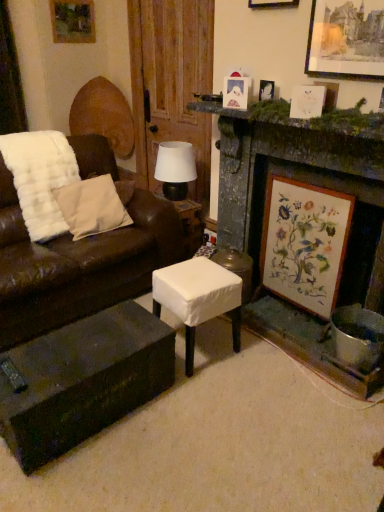
Identify the location of free space above white fabric-covered stool at center (from a real-world perspective). (196, 276).